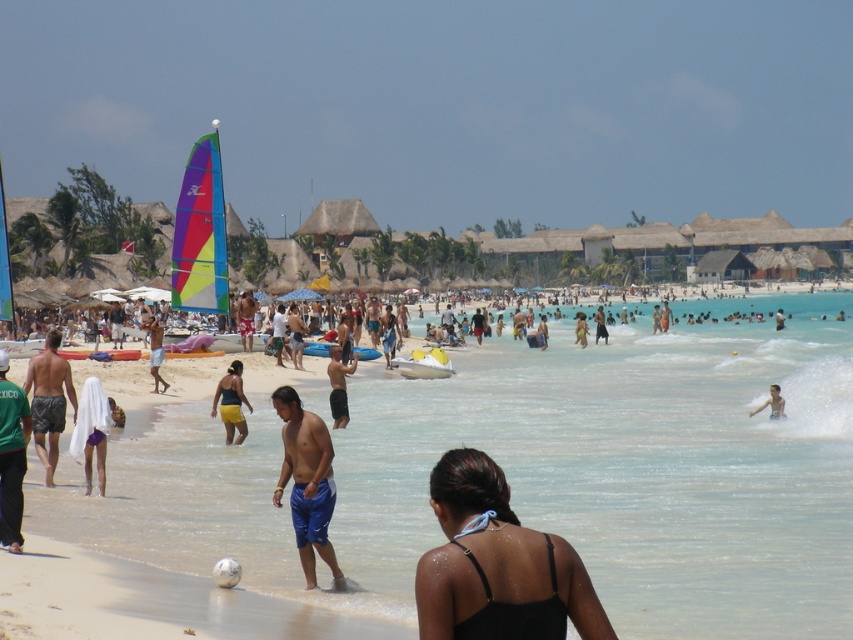
Question: Can you confirm if black matte swimsuit at lower center is bigger than smooth skin person at lower right?

Choices:
 (A) no
 (B) yes

Answer: (A)

Question: Can you confirm if tan skin man at center is bigger than tan skin human at center?

Choices:
 (A) no
 (B) yes

Answer: (B)

Question: Which point is closer to the camera taking this photo?

Choices:
 (A) (387, 316)
 (B) (775, 394)
 (C) (325, 524)

Answer: (C)

Question: Estimate the real-world distances between objects in this image. Which object is closer to the smooth skin person at lower right?

Choices:
 (A) black matte swimsuit at lower center
 (B) dark blue shorts at center

Answer: (B)

Question: Can you confirm if shiny blue shorts at center is positioned to the right of tan skin human at center?

Choices:
 (A) no
 (B) yes

Answer: (A)

Question: Which of these objects is positioned farthest from the smooth skin person at lower right?

Choices:
 (A) green fabric shirt at lower left
 (B) matte yellow shorts at center

Answer: (A)